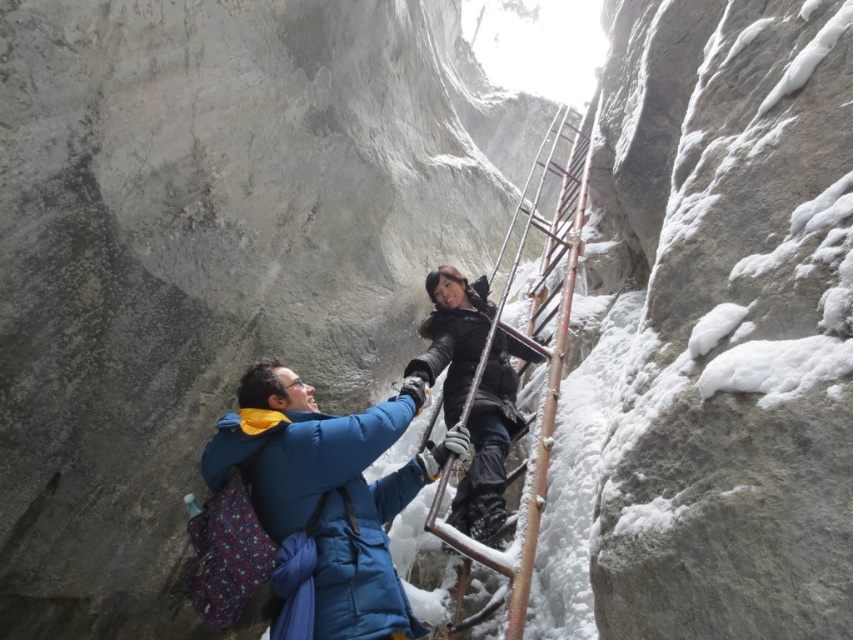
Can you confirm if blue down jacket at center is positioned above black matte jacket at center?

Actually, blue down jacket at center is below black matte jacket at center.

Between blue down jacket at center and black matte jacket at center, which one is positioned higher?

black matte jacket at center is higher up.

Locate an element on the screen. The height and width of the screenshot is (640, 853). blue down jacket at center is located at coordinates (328, 499).

This screenshot has height=640, width=853. I want to click on blue down jacket at center, so (328, 499).

Between point (547, 396) and point (447, 406), which one is positioned behind?

Positioned behind is point (447, 406).

Where is `rusty metal ladder at center`? rusty metal ladder at center is located at coordinates (532, 356).

Between point (325, 483) and point (538, 161), which one is positioned behind?

The point (538, 161) is more distant.

Who is more distant from viewer, [282,483] or [560,355]?

Positioned behind is point [560,355].

Locate an element on the screen. This screenshot has width=853, height=640. blue down jacket at center is located at coordinates (328, 499).